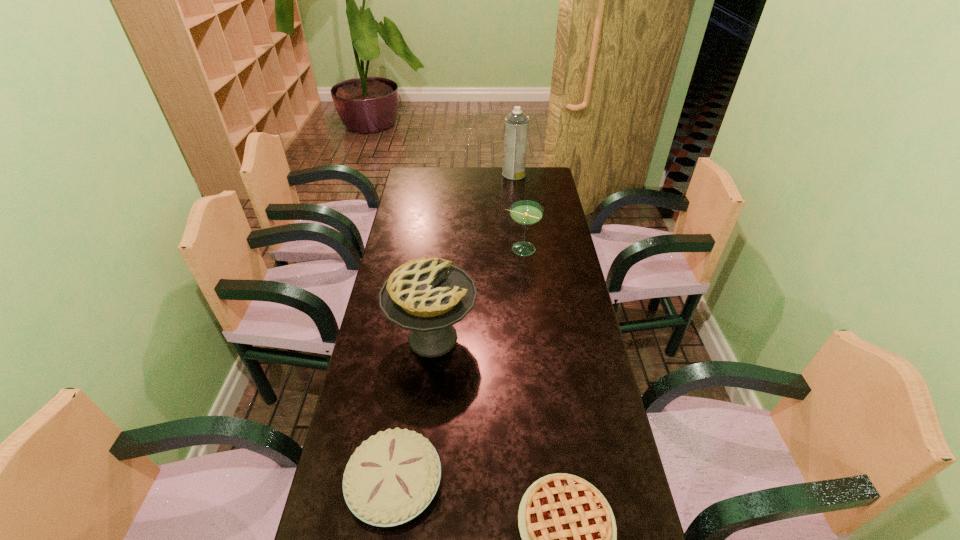
Find the location of `vacant region located on the right of the second tallest pie`. vacant region located on the right of the second tallest pie is located at coordinates (503, 483).

This screenshot has width=960, height=540. I want to click on object that is at the far edge, so click(x=516, y=124).

In order to click on aerosol can at the right edge in this screenshot , I will do `click(516, 124)`.

Image resolution: width=960 pixels, height=540 pixels. Find the location of `martini located at the right edge`. martini located at the right edge is located at coordinates (525, 212).

I want to click on object at the far right corner, so click(516, 124).

At what (x,y) coordinates should I click in order to perform the action: click on vacant space at the left edge of the desktop. Please return your answer as a coordinate pair (x, y). The width and height of the screenshot is (960, 540). Looking at the image, I should click on (410, 380).

I want to click on vacant space at the right edge of the desktop, so click(x=528, y=192).

Where is `vacant space at the far left corner of the desktop`? The image size is (960, 540). vacant space at the far left corner of the desktop is located at coordinates (431, 188).

Locate an element on the screen. vacant area that lies between the third nearest object and the aerosol can is located at coordinates tap(473, 256).

The height and width of the screenshot is (540, 960). I want to click on object that is the fourth closest to the third tallest object, so click(569, 536).